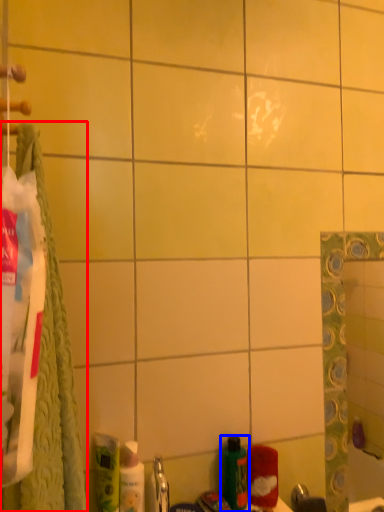
Question: Which object appears farthest to the camera in this image, bath towel (highlighted by a red box) or bottle (highlighted by a blue box)?

Choices:
 (A) bath towel
 (B) bottle

Answer: (B)